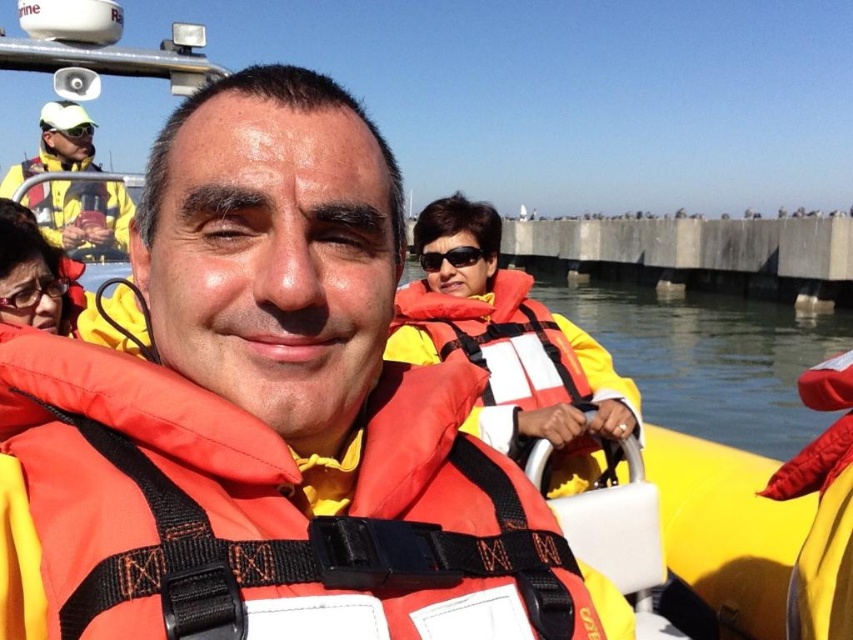
Question: Does orange matte life jacket at center come behind orange life jacket at center?

Choices:
 (A) yes
 (B) no

Answer: (B)

Question: Which of these objects is positioned farthest from the yellow matte jacket at upper left?

Choices:
 (A) black plastic sunglasses at center
 (B) matte black goggles at upper left
 (C) orange life vest at center
 (D) orange life jacket at center

Answer: (C)

Question: Which object is the closest to the black plastic sunglasses at center?

Choices:
 (A) yellow matte jacket at upper left
 (B) orange matte life jacket at center
 (C) orange life jacket at center

Answer: (C)

Question: Is orange matte life jacket at center to the left of matte black goggles at upper left from the viewer's perspective?

Choices:
 (A) yes
 (B) no

Answer: (B)

Question: Which point appears farthest from the camera in this image?

Choices:
 (A) (431, 272)
 (B) (509, 484)

Answer: (A)

Question: Does orange life vest at center appear over black plastic sunglasses at center?

Choices:
 (A) yes
 (B) no

Answer: (B)